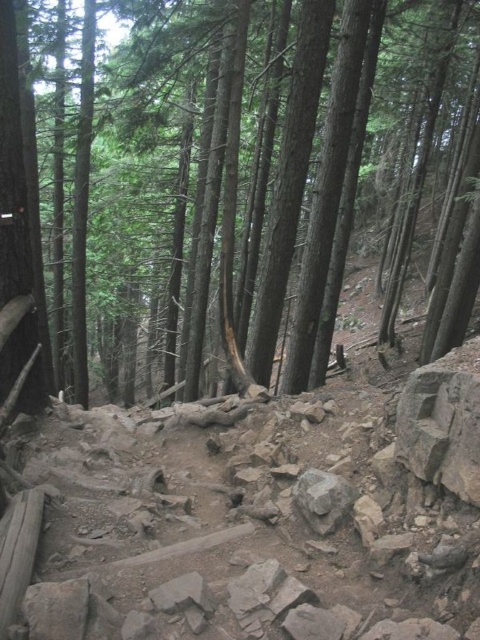
Question: Where is brown rough tree at center located in relation to gray rough rock at center in the image?

Choices:
 (A) left
 (B) right

Answer: (A)

Question: Is brown rough tree at center positioned at the back of gray rough rock at center?

Choices:
 (A) yes
 (B) no

Answer: (A)

Question: Is brown rough tree at center further to the viewer compared to gray rough rock at center?

Choices:
 (A) yes
 (B) no

Answer: (A)

Question: Which point is closer to the camera taking this photo?

Choices:
 (A) (248, 60)
 (B) (292, 499)

Answer: (B)

Question: Which object appears closest to the camera in this image?

Choices:
 (A) gray rough rock at center
 (B) brown rough tree at center

Answer: (A)